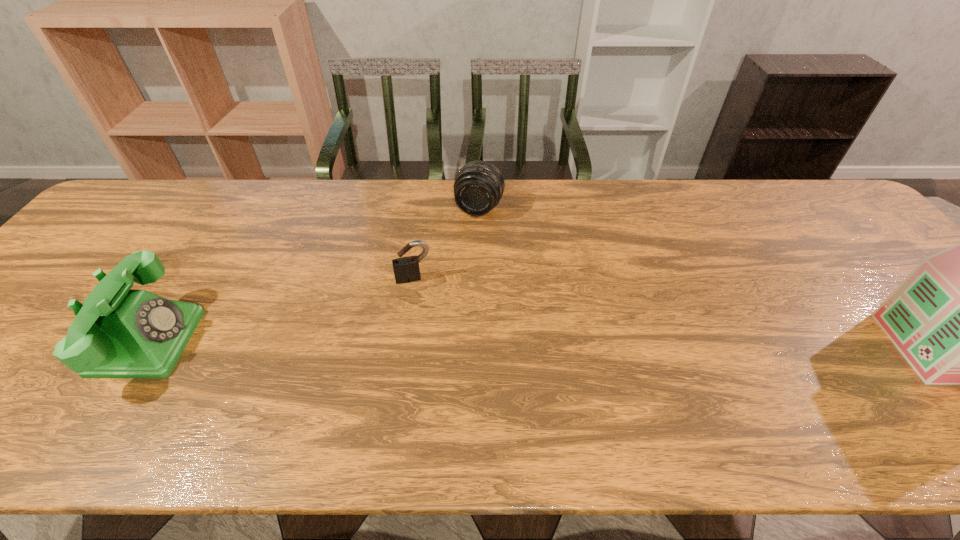
Where is `vacant area that lies between the third object from left to right and the shortest object`? Image resolution: width=960 pixels, height=540 pixels. vacant area that lies between the third object from left to right and the shortest object is located at coordinates (446, 244).

This screenshot has height=540, width=960. Identify the location of vacant space in between the leftmost object and the second farthest object. (280, 310).

Identify the location of free space between the telephoto lens and the third shortest object. (314, 275).

Find the location of `vacant point located between the third shortest object and the third tallest object`. vacant point located between the third shortest object and the third tallest object is located at coordinates (314, 275).

Choose which object is the third nearest neighbor to the telephoto lens. Please provide its 2D coordinates. Your answer should be formatted as a tuple, i.e. [(x, y)], where the tuple contains the x and y coordinates of a point satisfying the conditions above.

[(959, 318)]

The height and width of the screenshot is (540, 960). Identify the location of object identified as the closest to the third tallest object. (406, 269).